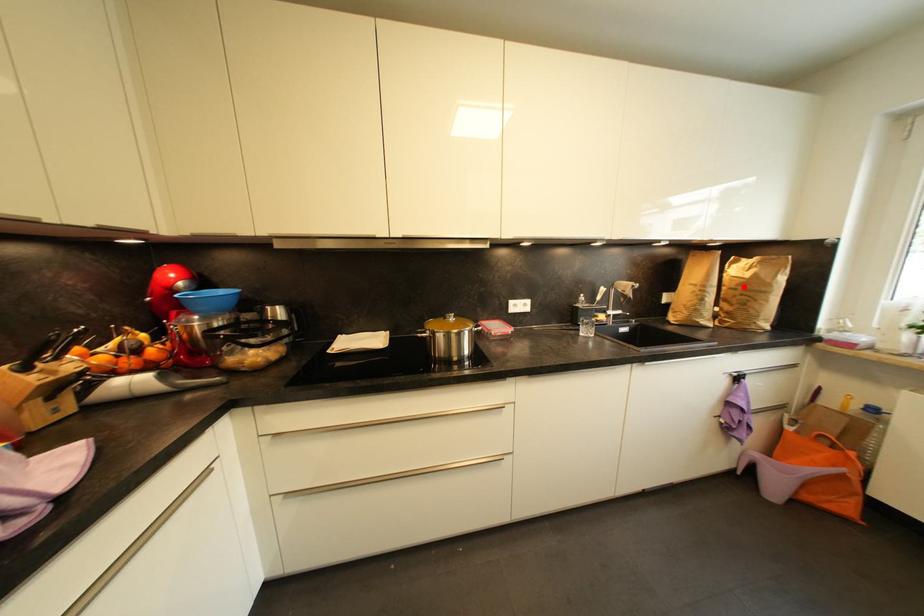
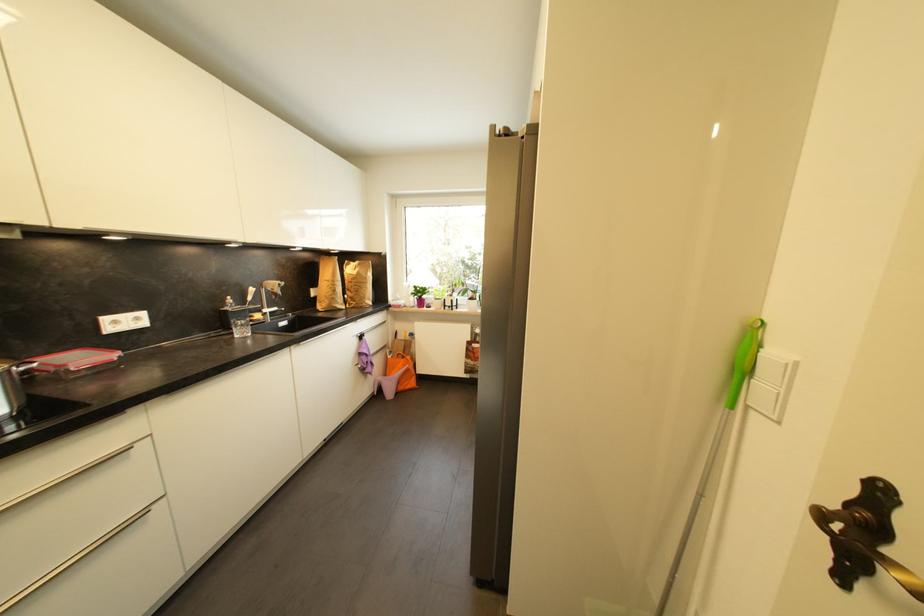
Question: I am providing you with two images of the same scene from different viewpoints. Given a red point in image1, look at the same physical point in image2. Is it:

Choices:
 (A) Closer to the viewpoint
 (B) Farther from the viewpoint

Answer: (A)